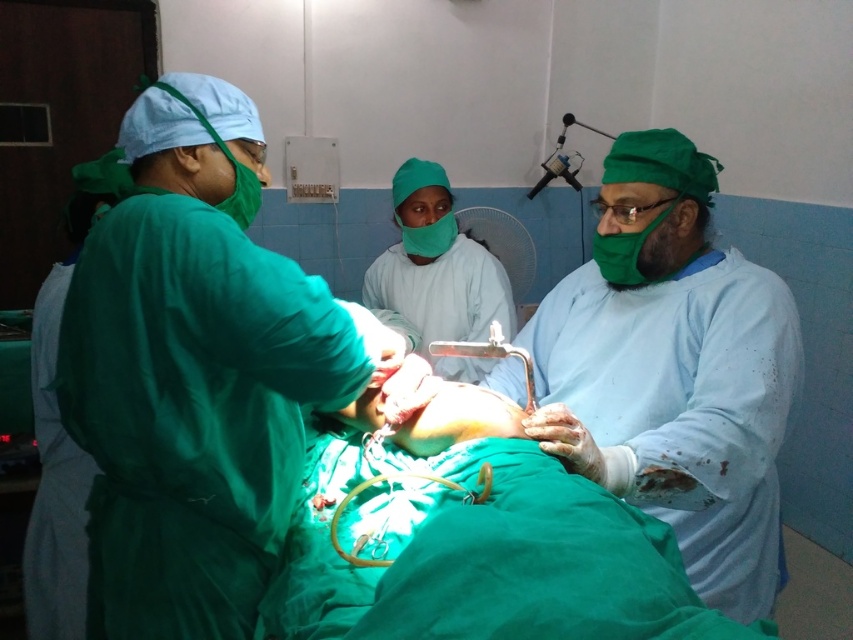
You are a medical student observing a surgery. You notice two surgeons wearing different colored gowns. The green matte surgical gown at left and the blue surgical gown at center. Which surgeon is shorter?

The green matte surgical gown at left is shorter than the blue surgical gown at center, so the surgeon in the green matte surgical gown at left is shorter.